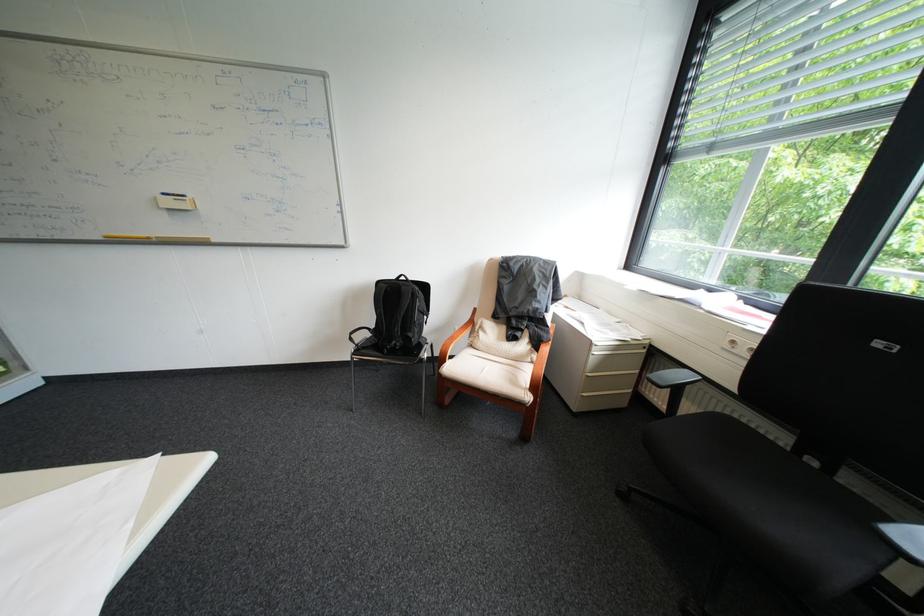
The width and height of the screenshot is (924, 616). I want to click on chair sitting surface, so click(x=490, y=373).